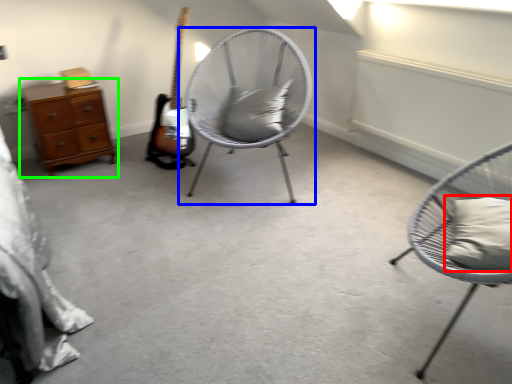
Question: Which is nearer to the pillow (highlighted by a red box)? chair (highlighted by a blue box) or chest of drawers (highlighted by a green box).

Choices:
 (A) chair
 (B) chest of drawers

Answer: (A)